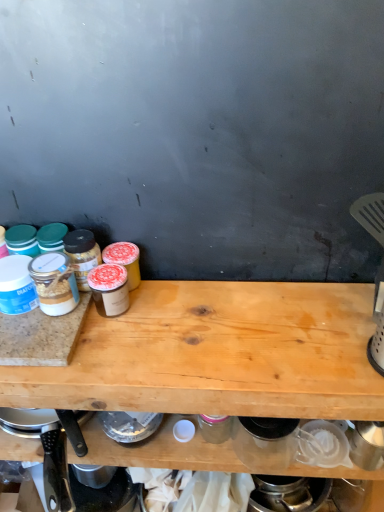
Question: From the image's perspective, is granite cutting board at left under black plastic knife at lower left?

Choices:
 (A) yes
 (B) no

Answer: (B)

Question: Is granite cutting board at left smaller than black plastic knife at lower left?

Choices:
 (A) yes
 (B) no

Answer: (A)

Question: Is granite cutting board at left at the left side of black plastic knife at lower left?

Choices:
 (A) yes
 (B) no

Answer: (A)

Question: Is granite cutting board at left oriented away from black plastic knife at lower left?

Choices:
 (A) yes
 (B) no

Answer: (B)

Question: From the image's perspective, does granite cutting board at left appear higher than black plastic knife at lower left?

Choices:
 (A) yes
 (B) no

Answer: (A)

Question: Is granite cutting board at left aimed at black plastic knife at lower left?

Choices:
 (A) yes
 (B) no

Answer: (B)

Question: Would you consider black plastic knife at lower left to be distant from light brown wood at center?

Choices:
 (A) no
 (B) yes

Answer: (A)

Question: Is black plastic knife at lower left wider than light brown wood at center?

Choices:
 (A) no
 (B) yes

Answer: (A)

Question: Is black plastic knife at lower left aimed at light brown wood at center?

Choices:
 (A) no
 (B) yes

Answer: (B)

Question: Considering the relative sizes of black plastic knife at lower left and light brown wood at center in the image provided, is black plastic knife at lower left bigger than light brown wood at center?

Choices:
 (A) yes
 (B) no

Answer: (B)

Question: Is black plastic knife at lower left closer to the viewer compared to light brown wood at center?

Choices:
 (A) no
 (B) yes

Answer: (A)

Question: Does black plastic knife at lower left have a smaller size compared to light brown wood at center?

Choices:
 (A) yes
 (B) no

Answer: (A)

Question: Does light brown wood at center appear on the right side of granite cutting board at left?

Choices:
 (A) no
 (B) yes

Answer: (B)